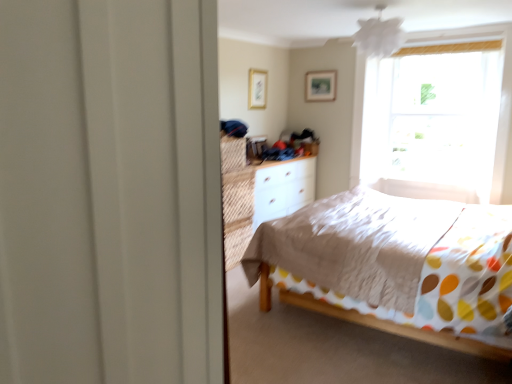
Question: Can you confirm if white matte dresser at center is bigger than white textured bed at center?

Choices:
 (A) yes
 (B) no

Answer: (B)

Question: Is white matte dresser at center touching white textured bed at center?

Choices:
 (A) yes
 (B) no

Answer: (B)

Question: Can you confirm if white matte dresser at center is taller than white textured bed at center?

Choices:
 (A) no
 (B) yes

Answer: (A)

Question: From the image's perspective, is white matte dresser at center beneath white textured bed at center?

Choices:
 (A) no
 (B) yes

Answer: (A)

Question: From the image's perspective, is white matte dresser at center located above white textured bed at center?

Choices:
 (A) yes
 (B) no

Answer: (A)

Question: Can you confirm if white matte dresser at center is smaller than white textured bed at center?

Choices:
 (A) no
 (B) yes

Answer: (B)

Question: Is the position of wooden picture frame at upper center, positioned as the 2th picture frame in right-to-left order, more distant than that of white textured bed at center?

Choices:
 (A) no
 (B) yes

Answer: (B)

Question: From a real-world perspective, is wooden picture frame at upper center, the first picture frame positioned from the left, under white textured bed at center?

Choices:
 (A) yes
 (B) no

Answer: (B)

Question: Is white textured bed at center at the back of wooden picture frame at upper center, positioned as the 2th picture frame in right-to-left order?

Choices:
 (A) no
 (B) yes

Answer: (A)

Question: Does wooden picture frame at upper center, the 1th picture frame positioned from the front, have a larger size compared to white textured bed at center?

Choices:
 (A) yes
 (B) no

Answer: (B)

Question: From the image's perspective, is wooden picture frame at upper center, which appears as the second picture frame when viewed from the back, on white textured bed at center?

Choices:
 (A) yes
 (B) no

Answer: (A)

Question: Is wooden picture frame at upper center, which appears as the second picture frame when viewed from the back, taller than white textured bed at center?

Choices:
 (A) no
 (B) yes

Answer: (A)

Question: Is white textured bed at center smaller than wooden picture frame at upper center, the 1th picture frame positioned from the front?

Choices:
 (A) yes
 (B) no

Answer: (B)